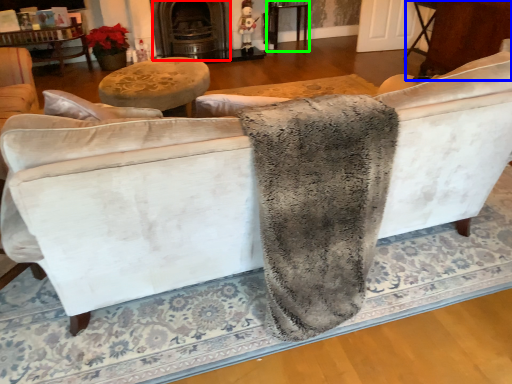
Question: Which is nearer to the fireplace (highlighted by a red box)? table (highlighted by a blue box) or table (highlighted by a green box).

Choices:
 (A) table
 (B) table

Answer: (B)